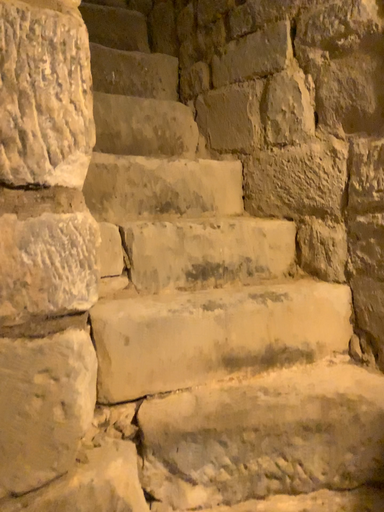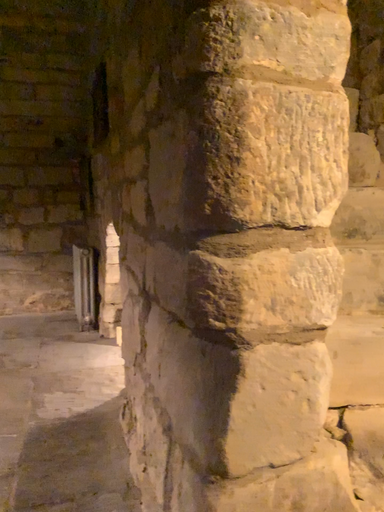
Question: How did the camera likely rotate when shooting the video?

Choices:
 (A) rotated right
 (B) rotated left

Answer: (B)